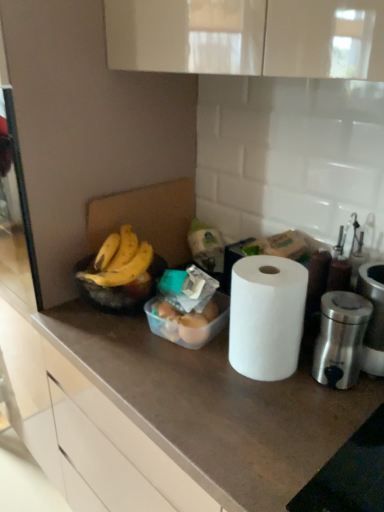
Question: Is white matte paper towel at center looking in the opposite direction of translucent plastic eggs at center?

Choices:
 (A) no
 (B) yes

Answer: (A)

Question: From the image's perspective, would you say white matte paper towel at center is shown under translucent plastic eggs at center?

Choices:
 (A) no
 (B) yes

Answer: (A)

Question: Is white matte paper towel at center bigger than translucent plastic eggs at center?

Choices:
 (A) yes
 (B) no

Answer: (A)

Question: Is translucent plastic eggs at center inside white matte paper towel at center?

Choices:
 (A) no
 (B) yes

Answer: (A)

Question: Can we say white matte paper towel at center lies outside translucent plastic eggs at center?

Choices:
 (A) yes
 (B) no

Answer: (A)

Question: From the image's perspective, relative to white matte countertop at center, is yellow matte bananas at left above or below?

Choices:
 (A) below
 (B) above

Answer: (B)

Question: Choose the correct answer: Is yellow matte bananas at left inside white matte countertop at center or outside it?

Choices:
 (A) outside
 (B) inside

Answer: (A)

Question: Is yellow matte bananas at left to the left or to the right of white matte countertop at center in the image?

Choices:
 (A) left
 (B) right

Answer: (A)

Question: Based on their sizes in the image, would you say yellow matte bananas at left is bigger or smaller than white matte countertop at center?

Choices:
 (A) big
 (B) small

Answer: (B)

Question: Is polished stainless steel appliance at right taller or shorter than translucent plastic eggs at center?

Choices:
 (A) tall
 (B) short

Answer: (A)

Question: Is polished stainless steel appliance at right wider or thinner than translucent plastic eggs at center?

Choices:
 (A) thin
 (B) wide

Answer: (A)

Question: From the image's perspective, is polished stainless steel appliance at right positioned above or below translucent plastic eggs at center?

Choices:
 (A) above
 (B) below

Answer: (B)

Question: Which is correct: polished stainless steel appliance at right is inside translucent plastic eggs at center, or outside of it?

Choices:
 (A) outside
 (B) inside

Answer: (A)

Question: In the image, is polished stainless steel appliance at right on the left side or the right side of white matte countertop at center?

Choices:
 (A) right
 (B) left

Answer: (A)

Question: Based on their sizes in the image, would you say polished stainless steel appliance at right is bigger or smaller than white matte countertop at center?

Choices:
 (A) big
 (B) small

Answer: (B)